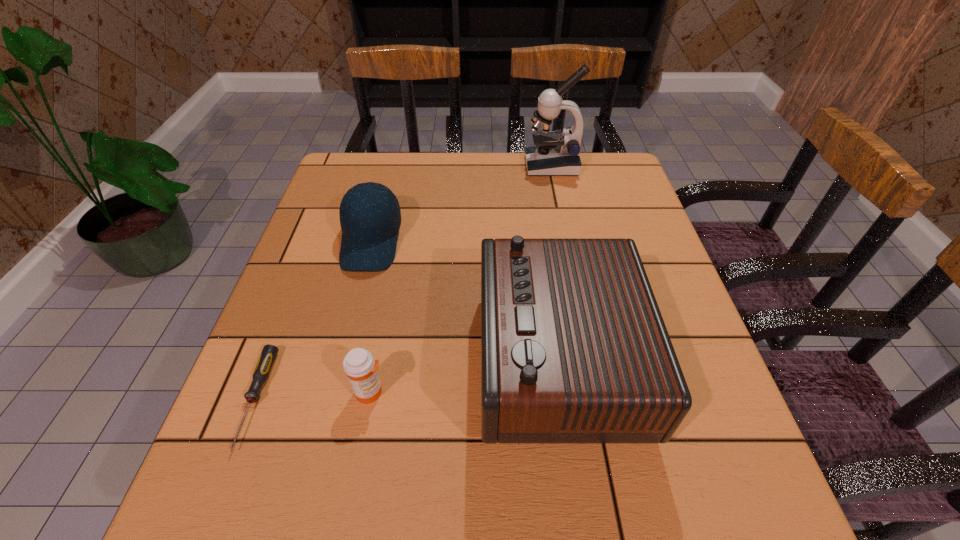
Where is `vacant space situated at the eyepiece of the microscope`? vacant space situated at the eyepiece of the microscope is located at coordinates (509, 166).

The width and height of the screenshot is (960, 540). I want to click on vacant position located 0.270m on the front panel of the radio receiver, so click(x=341, y=357).

Image resolution: width=960 pixels, height=540 pixels. What are the coordinates of `free space located 0.060m on the front panel of the radio receiver` in the screenshot? It's located at coord(450,357).

In order to click on vacant space located on the front panel of the radio receiver in this screenshot , I will do `click(320, 357)`.

Image resolution: width=960 pixels, height=540 pixels. I want to click on free space located 0.060m on the front-facing side of the baseball cap, so click(357, 296).

The width and height of the screenshot is (960, 540). In order to click on free space located 0.070m on the back of the second shortest object in this screenshot , I will do `click(379, 348)`.

The width and height of the screenshot is (960, 540). I want to click on object positioned at the far edge, so click(554, 153).

Identify the location of baseball cap situated at the left edge. point(370,217).

Where is `screwdriver that is positioned at the left edge`? screwdriver that is positioned at the left edge is located at coordinates (268, 355).

Locate an element on the screen. microscope present at the right edge is located at coordinates (554, 153).